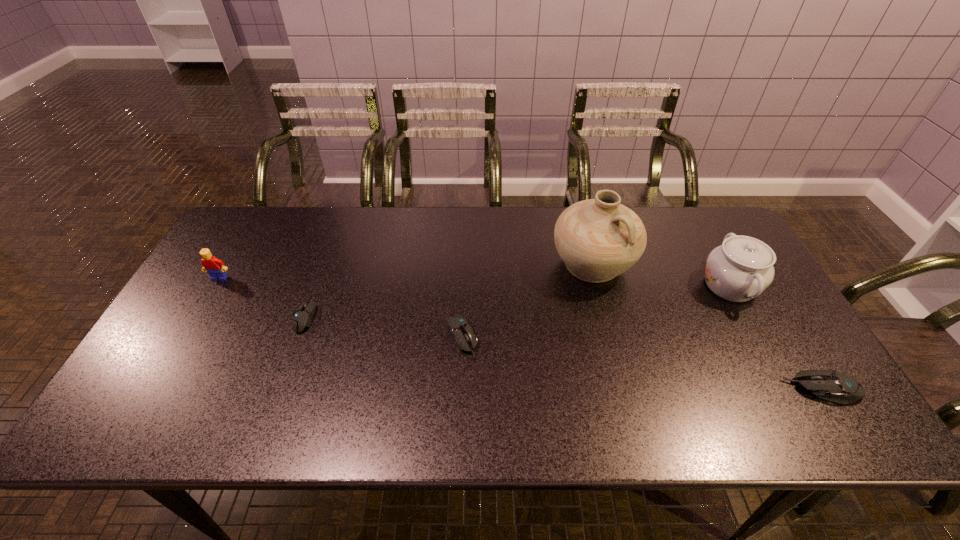
Point out which computer mouse is positioned as the second nearest to the third tallest object. Please provide its 2D coordinates. Your answer should be formatted as a tuple, i.e. [(x, y)], where the tuple contains the x and y coordinates of a point satisfying the conditions above.

[(459, 328)]

Where is `computer mouse that stands as the second closest to the second shortest object`? The width and height of the screenshot is (960, 540). computer mouse that stands as the second closest to the second shortest object is located at coordinates (830, 385).

You are a GUI agent. You are given a task and a screenshot of the screen. Output one action in this format:
    pyautogui.click(x=<x>, y=<y>)
    Task: Click on the free spot that satisfies the following two spatial constraints: 1. on the face of the Lego; 2. on the right side of the second tallest object
    The image size is (960, 540).
    Given the screenshot: What is the action you would take?
    pyautogui.click(x=215, y=286)

You are a GUI agent. You are given a task and a screenshot of the screen. Output one action in this format:
    pyautogui.click(x=<x>, y=<y>)
    Task: Click on the vacant point that satisfies the following two spatial constraints: 1. on the face of the second tallest computer mouse; 2. on the right side of the leftmost object
    The height and width of the screenshot is (540, 960).
    Given the screenshot: What is the action you would take?
    pyautogui.click(x=184, y=338)

Find the location of `free space that satisfies the following two spatial constraints: 1. on the face of the third tallest object; 2. on the right side of the fifth shortest object`. free space that satisfies the following two spatial constraints: 1. on the face of the third tallest object; 2. on the right side of the fifth shortest object is located at coordinates (215, 286).

Find the location of a particular element. This screenshot has width=960, height=540. free location that satisfies the following two spatial constraints: 1. on the face of the fourth shortest object; 2. on the left side of the third object from left to right is located at coordinates (184, 338).